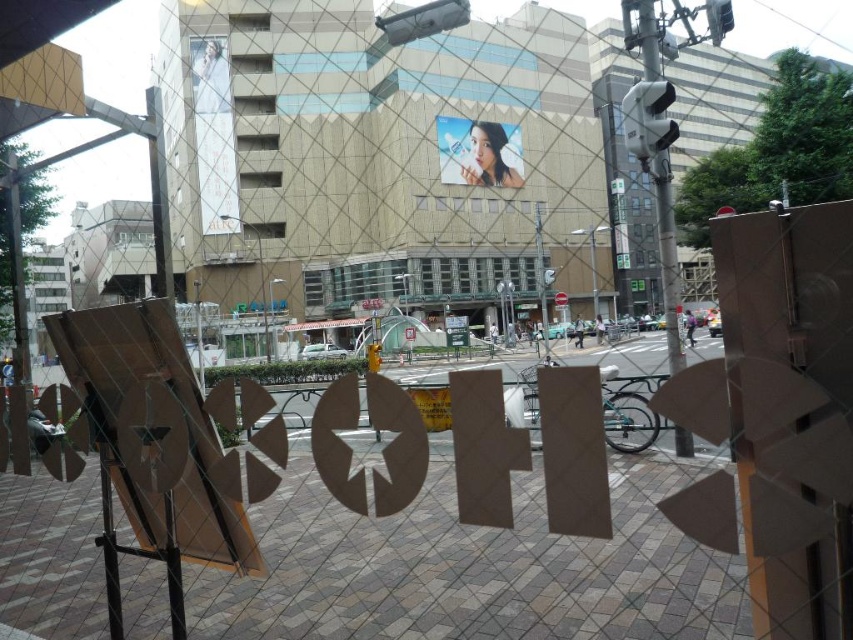
You are standing inside a building and looking through the window with the KOSHI sign. You want to know where the white plastic traffic light at upper right is located relative to the KOSHI sign. Can you describe its position using the grid pattern on the window?

The white plastic traffic light at upper right is located at the grid point closest to coordinates (648, 118) on the window. Since the KOSHI sign is in the foreground, the traffic light is positioned behind it in the scene.

You are a delivery person trying to see the street name through the window. The smooth glossy poster at center and the metallic pole at center are blocking your view. Which object do you need to move to get a clearer view of the street name?

The smooth glossy poster at center is shorter than the metallic pole at center, so moving the metallic pole at center would allow you to see over the shorter smooth glossy poster at center for a clearer view.